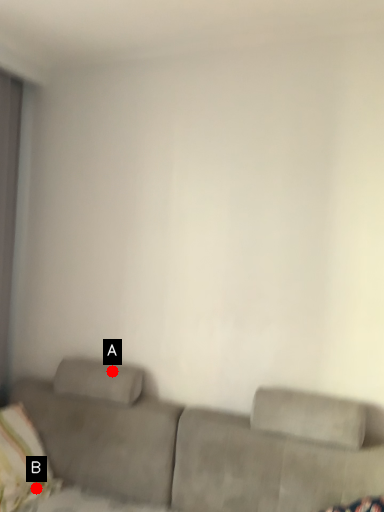
Question: Two points are circled on the image, labeled by A and B beside each circle. Among these points, which one is farthest from the camera?

Choices:
 (A) A is further
 (B) B is further

Answer: (A)